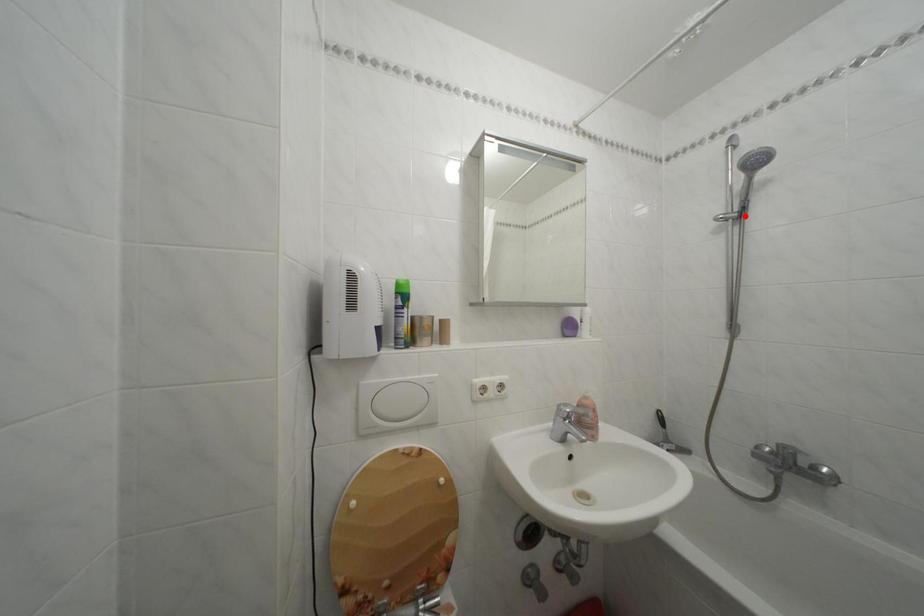
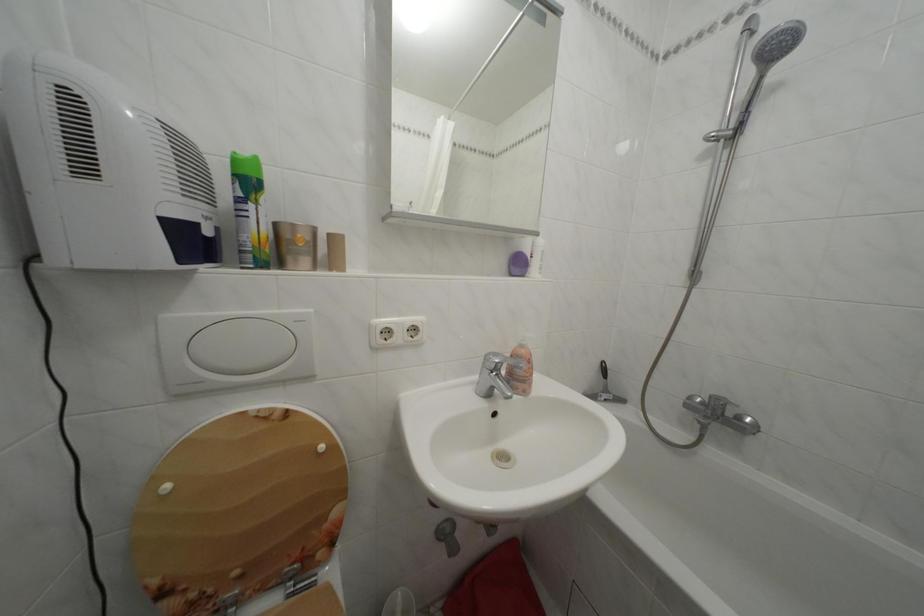
The point at the highlighted location is marked in the first image. Where is the corresponding point in the second image?

(742, 132)